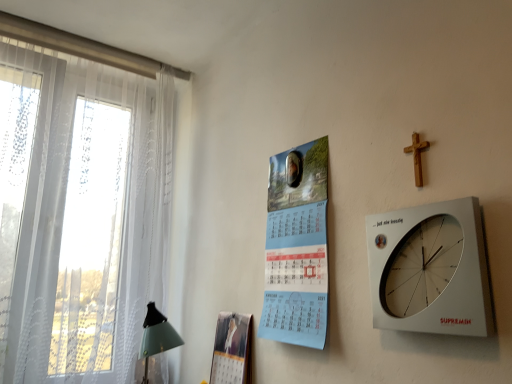
Question: Is light blue paper calendar at center further to the viewer compared to white plastic wall clock at upper right?

Choices:
 (A) no
 (B) yes

Answer: (B)

Question: Is light blue paper calendar at center far from white plastic wall clock at upper right?

Choices:
 (A) no
 (B) yes

Answer: (A)

Question: Is light blue paper calendar at center facing away from white plastic wall clock at upper right?

Choices:
 (A) no
 (B) yes

Answer: (A)

Question: Is light blue paper calendar at center bigger than white plastic wall clock at upper right?

Choices:
 (A) yes
 (B) no

Answer: (A)

Question: From the image's perspective, does light blue paper calendar at center appear lower than white plastic wall clock at upper right?

Choices:
 (A) no
 (B) yes

Answer: (A)

Question: Is light blue paper calendar at center to the right of white plastic wall clock at upper right from the viewer's perspective?

Choices:
 (A) yes
 (B) no

Answer: (B)

Question: Is light blue paper calendar at center further to camera compared to white sheer curtain at left?

Choices:
 (A) yes
 (B) no

Answer: (B)

Question: Can you confirm if light blue paper calendar at center is taller than white sheer curtain at left?

Choices:
 (A) yes
 (B) no

Answer: (B)

Question: Is light blue paper calendar at center wider than white sheer curtain at left?

Choices:
 (A) no
 (B) yes

Answer: (A)

Question: Is light blue paper calendar at center placed right next to white sheer curtain at left?

Choices:
 (A) no
 (B) yes

Answer: (A)

Question: Is light blue paper calendar at center oriented away from white sheer curtain at left?

Choices:
 (A) yes
 (B) no

Answer: (B)

Question: From the image's perspective, is light blue paper calendar at center on white sheer curtain at left?

Choices:
 (A) no
 (B) yes

Answer: (A)

Question: Does wooden cross at upper right have a greater height compared to white plastic wall clock at upper right?

Choices:
 (A) no
 (B) yes

Answer: (A)